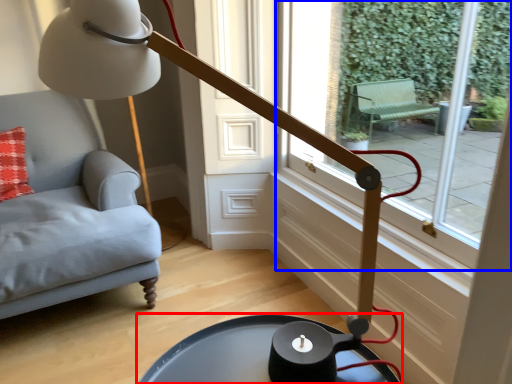
Question: Which object is further to the camera taking this photo, table (highlighted by a red box) or window (highlighted by a blue box)?

Choices:
 (A) table
 (B) window

Answer: (B)